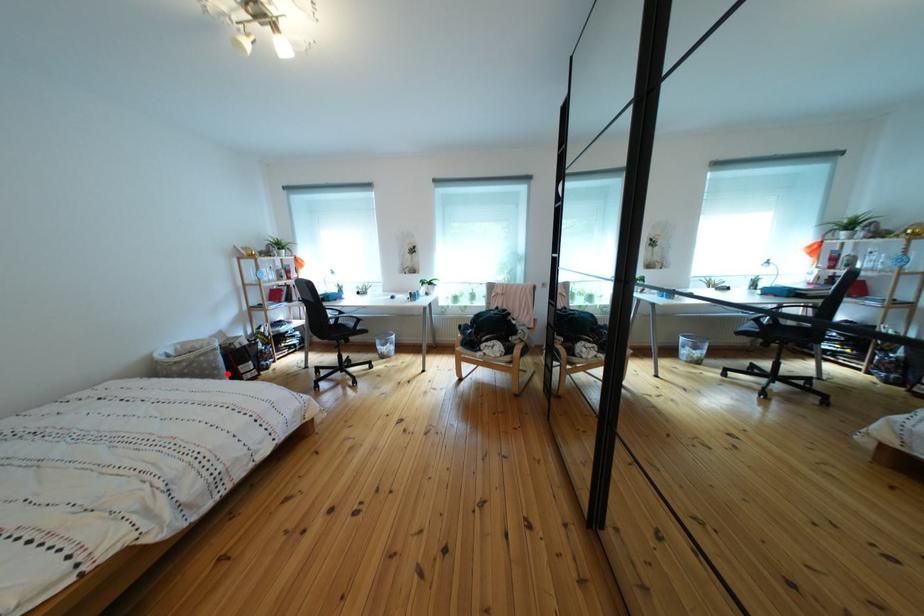
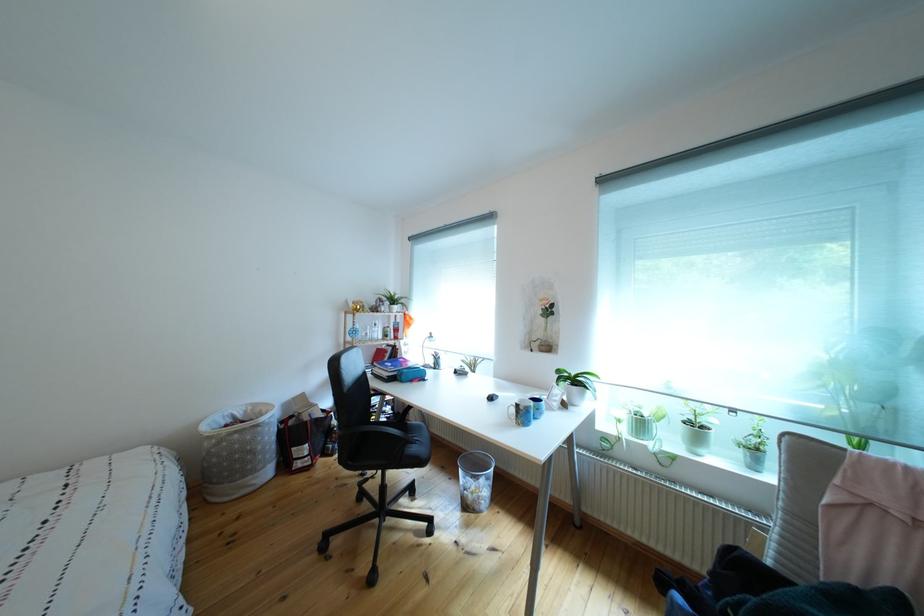
In the second image, find the point that corresponds to the highlighted location in the first image.

(263, 456)